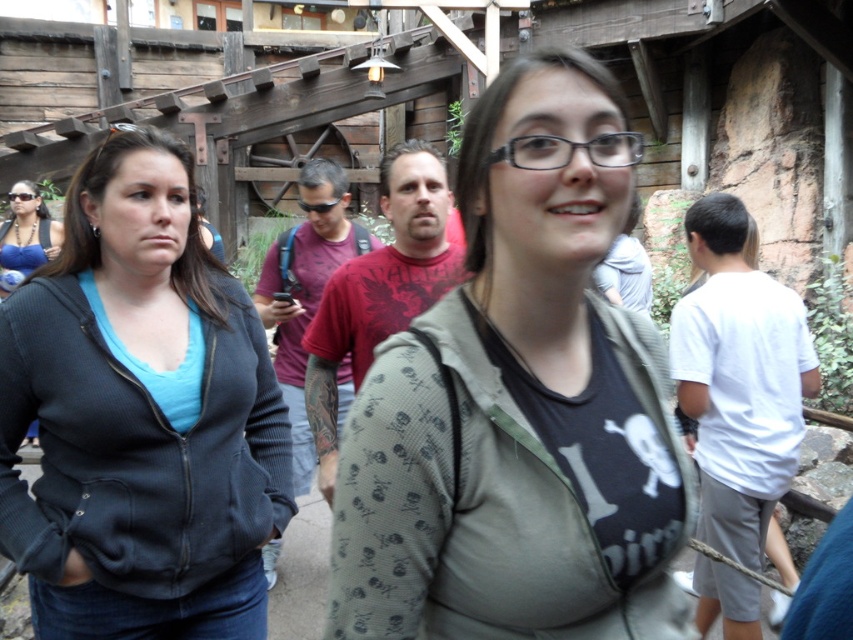
You are designing a clothing display for a store and need to arrange the white cotton shirt at right and the matte blue bikini top at upper left on a mannequin. Considering their sizes, which item should be placed higher on the mannequin to ensure proper visibility?

The white cotton shirt at right has a lesser width compared to the matte blue bikini top at upper left. To ensure proper visibility, the wider matte blue bikini top at upper left should be placed higher on the mannequin so it can be seen easily over the narrower white cotton shirt at right.

You are standing at the center of the scene and see the point marked at coordinates [520,404]. What object is located exactly at that point?

The point at coordinates [520,404] marks the location of the matte olive green hoodie at center.